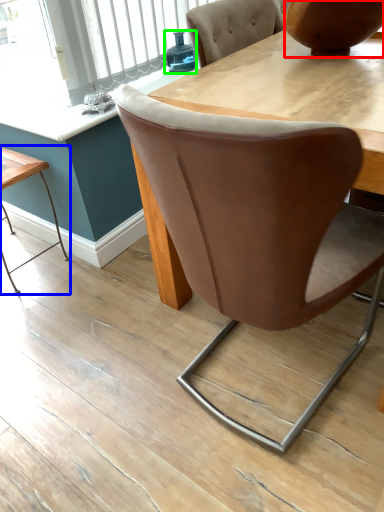
Question: Which object is the closest to the vase (highlighted by a red box)? Choose among these: table (highlighted by a blue box) or teal (highlighted by a green box).

Choices:
 (A) table
 (B) teal

Answer: (B)